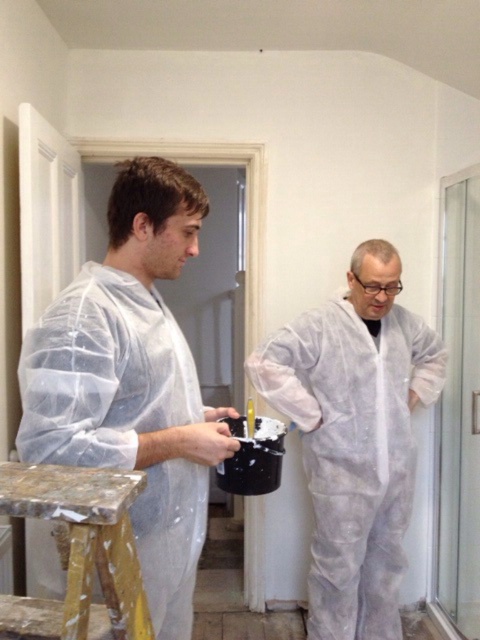
Question: Does transparent plastic coat at left have a smaller size compared to marbled wood stool at lower left?

Choices:
 (A) no
 (B) yes

Answer: (A)

Question: Can you confirm if transparent plastic coat at left is thinner than white matte coveralls at center?

Choices:
 (A) yes
 (B) no

Answer: (A)

Question: Which point is closer to the camera?

Choices:
 (A) marbled wood stool at lower left
 (B) transparent plastic coat at left
 (C) white matte coveralls at center

Answer: (A)

Question: Which point is closer to the camera?

Choices:
 (A) (14, 502)
 (B) (205, 472)
 (C) (350, 492)

Answer: (A)

Question: Can you confirm if transparent plastic coat at left is positioned to the left of white matte coveralls at center?

Choices:
 (A) no
 (B) yes

Answer: (B)

Question: Which point is closer to the camera taking this photo?

Choices:
 (A) (260, 387)
 (B) (186, 182)
 (C) (93, 488)

Answer: (C)